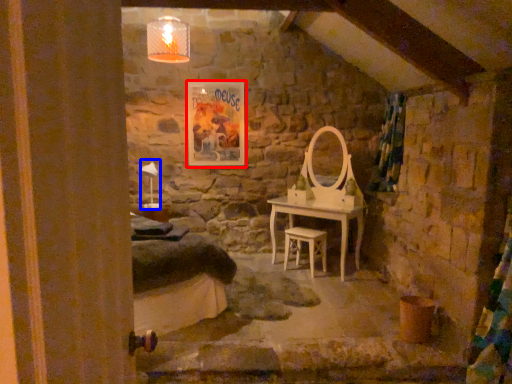
Question: Which object appears farthest to the camera in this image, picture frame (highlighted by a red box) or table lamp (highlighted by a blue box)?

Choices:
 (A) picture frame
 (B) table lamp

Answer: (A)